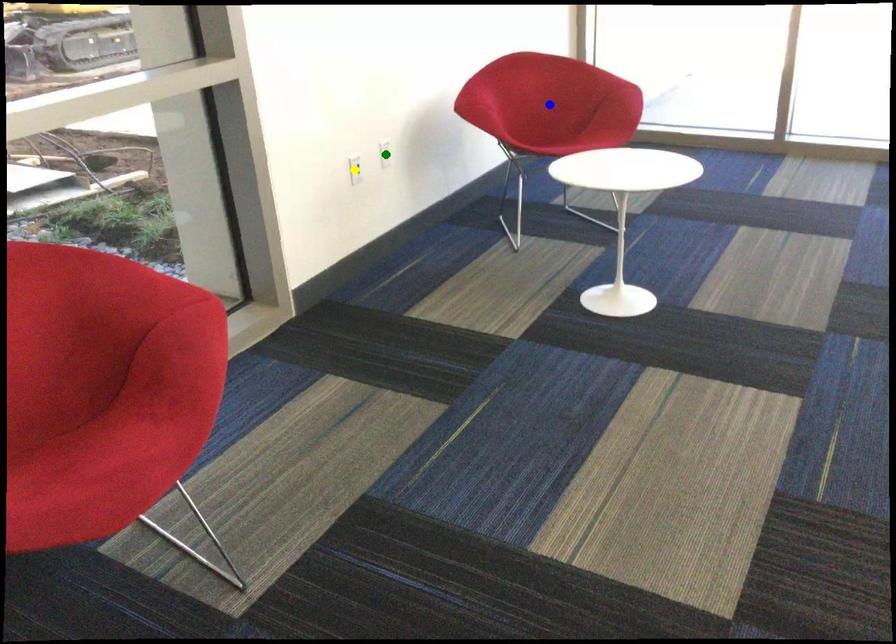
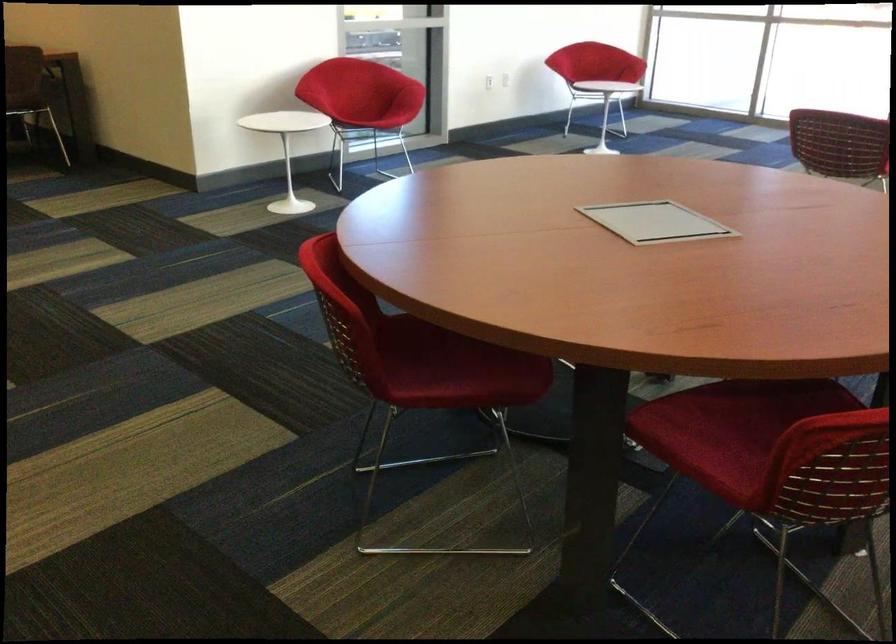
I am providing you with two images of the same scene from different viewpoints. Three points are marked in image1. Which point corresponds to a part or object that is occluded in image2?In image1, three points are marked. Which of them correspond to a part or object that is occluded in image2?Among the three points shown in image1, which one corresponds to a part or object that is no longer visible due to occlusion in image2?

yellow point, blue point, green point cannot be seen in image2.